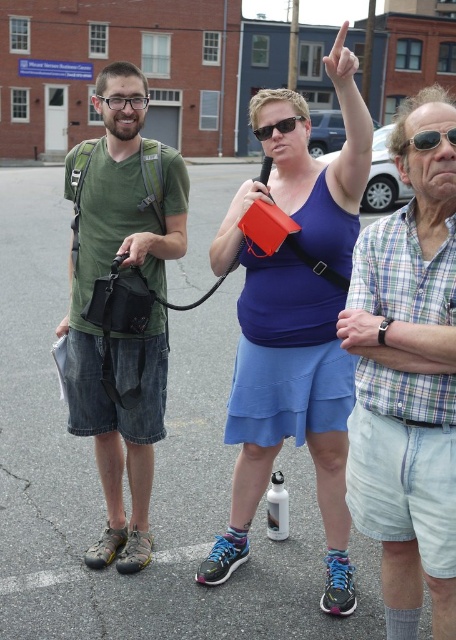
Is matte blue tank top at center below matte black watch at upper right?

Indeed, matte blue tank top at center is positioned under matte black watch at upper right.

You are a GUI agent. You are given a task and a screenshot of the screen. Output one action in this format:
    pyautogui.click(x=<x>, y=<y>)
    Task: Click on the matte blue tank top at center
    
    Given the screenshot: What is the action you would take?
    pyautogui.click(x=298, y=337)

The width and height of the screenshot is (456, 640). What do you see at coordinates (254, 195) in the screenshot?
I see `matte orange pouch at center` at bounding box center [254, 195].

From the picture: Who is more distant from viewer, (253, 193) or (57, 332)?

Positioned behind is point (57, 332).

Where is `matte orange pouch at center`? matte orange pouch at center is located at coordinates (254, 195).

Can you confirm if green matte t-shirt at left is shorter than matte black watch at upper right?

No.

Does green matte t-shirt at left have a greater height compared to matte black watch at upper right?

Correct, green matte t-shirt at left is much taller as matte black watch at upper right.

Is point (93, 566) in front of point (348, 330)?

No, it is behind (348, 330).

At what (x,y) coordinates should I click in order to perform the action: click on green matte t-shirt at left. Please return your answer as a coordinate pair (x, y). The image size is (456, 640). Looking at the image, I should click on (122, 307).